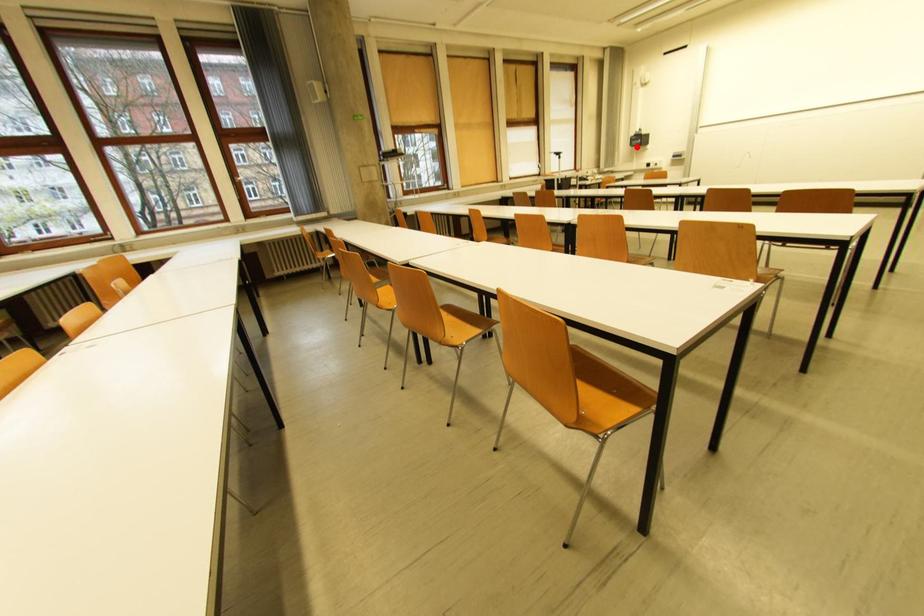
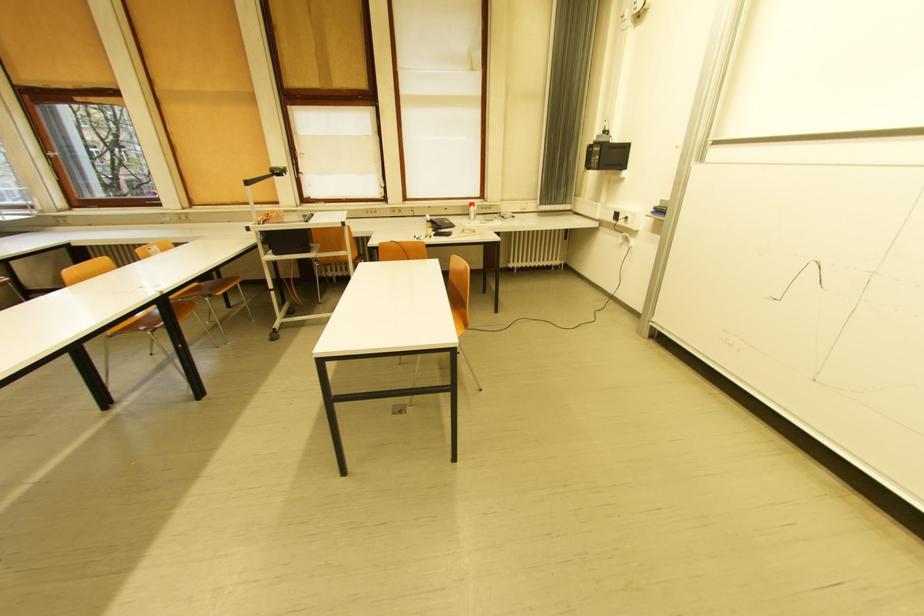
Where in the second image is the point corresponding to the highlighted location from the first image?

(592, 168)